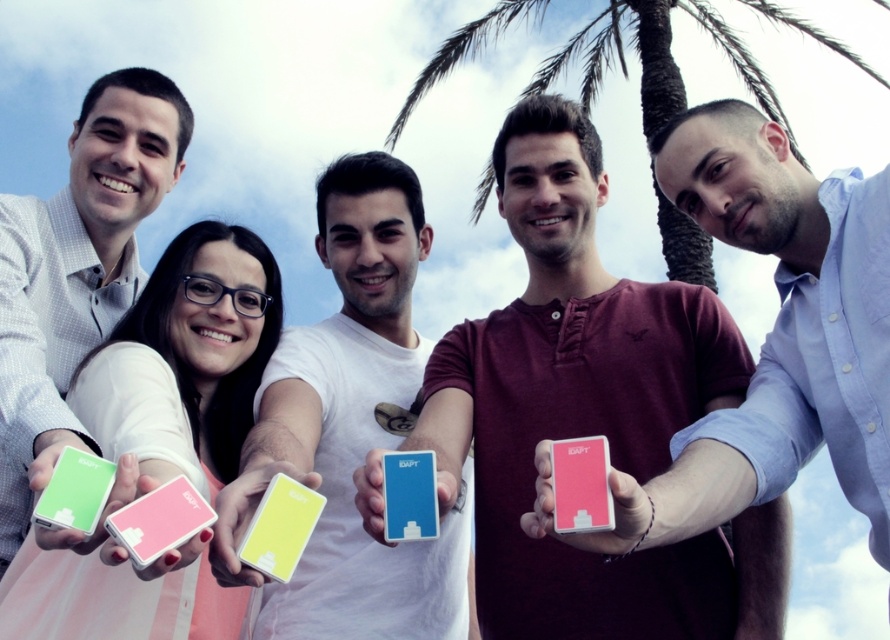
You are standing in the image and want to locate the point at coordinate (652, 58). Based on the scene description, where is this point located?

The point at coordinate (652, 58) is located on the green leafy palm tree at upper center.

You are a photographer trying to capture the green leafy palm tree at upper center and the green matte card at left in a single frame. Based on their sizes, which object would likely occupy more of the horizontal space in the photo?

The green leafy palm tree at upper center might be wider than green matte card at left, so it would likely occupy more horizontal space in the photo.

You are holding a matte plastic phone at center and a matte plastic card at center. Which one can you place in your pocket without folding it?

The matte plastic card at center can be placed in your pocket without folding it because it is smaller than the matte plastic phone at center.